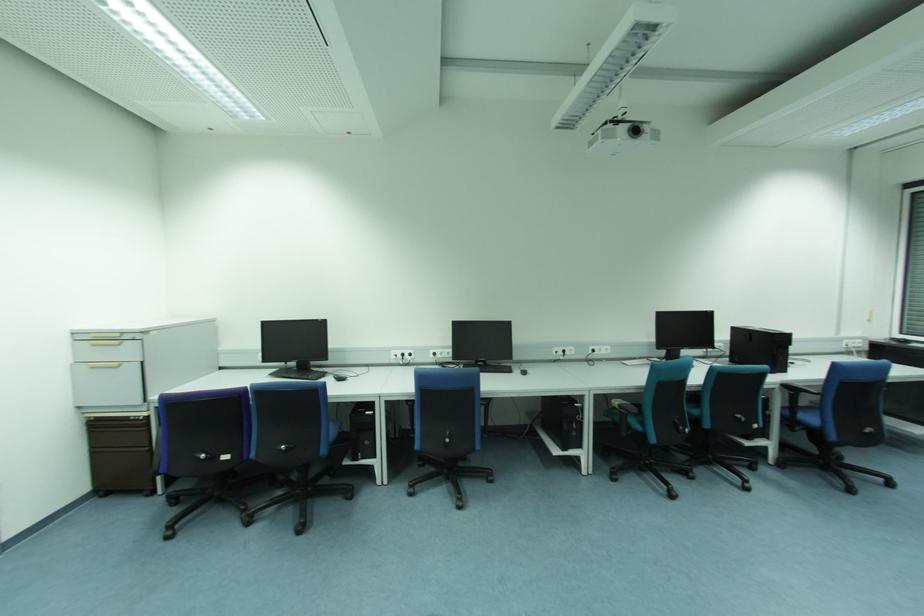
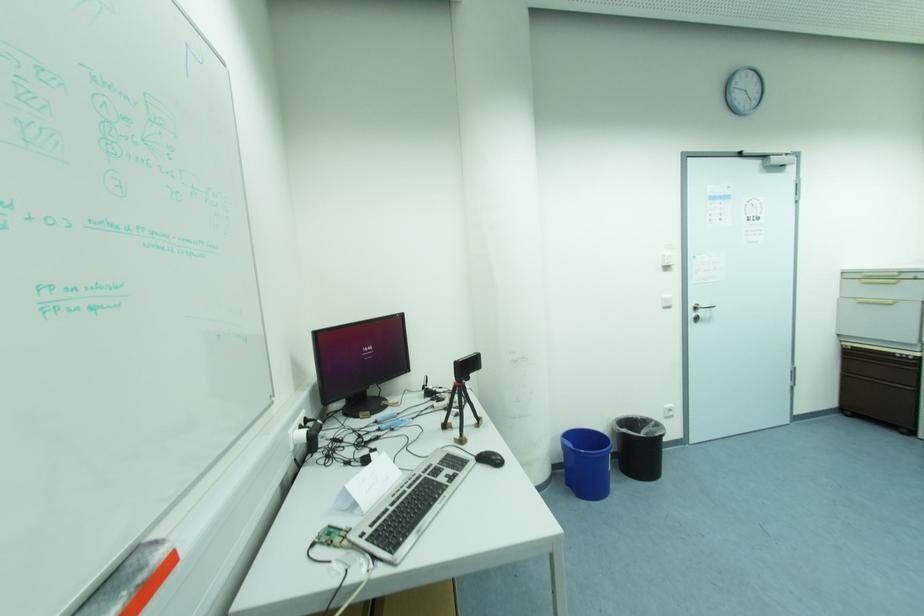
Question: I am providing you with two images of the same scene from different viewpoints. Which of the following objects are not visible in image2?

Choices:
 (A) blue trash bin
 (B) red and grey eraser
 (C) single-board computer
 (D) none of these

Answer: (D)